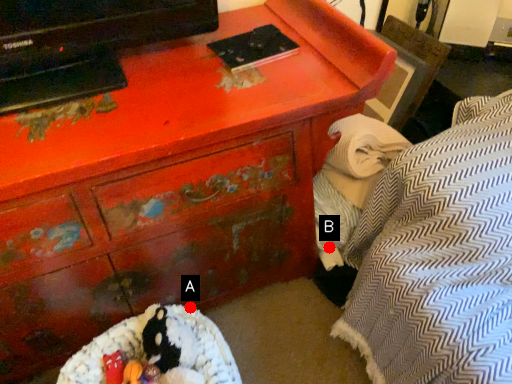
Question: Two points are circled on the image, labeled by A and B beside each circle. Which point is farther from the camera taking this photo?

Choices:
 (A) A is further
 (B) B is further

Answer: (B)